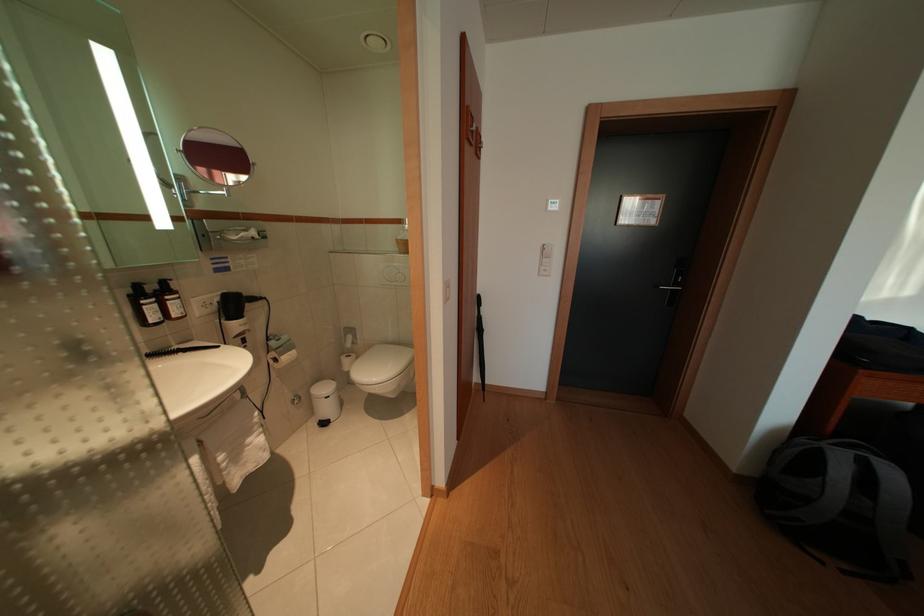
Describe the element at coordinates (393, 274) in the screenshot. I see `a toilet flush button` at that location.